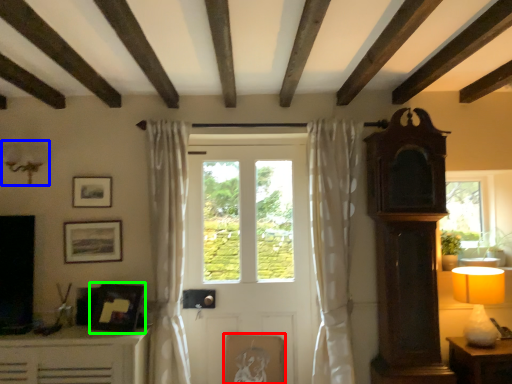
Question: Based on their relative distances, which object is nearer to picture frame (highlighted by a red box)? Choose from lamp (highlighted by a blue box) and picture frame (highlighted by a green box).

Choices:
 (A) lamp
 (B) picture frame

Answer: (B)